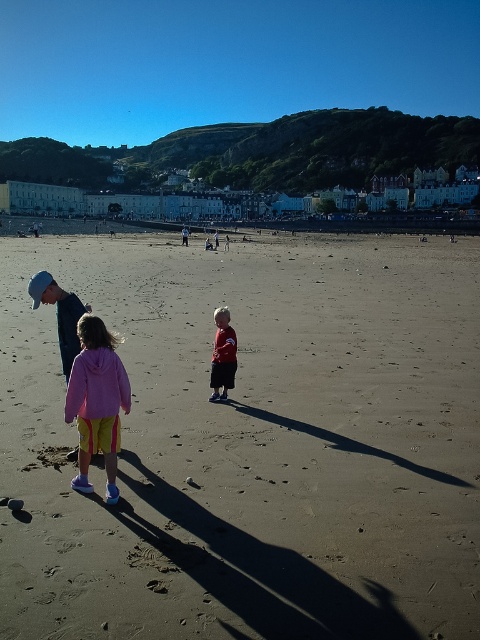
You are a photographer trying to capture a wide shot of the scene. You want to ensure that both the brown sandy beach at center and the matte red shirt at center are clearly visible in the frame. Given their sizes, which object will occupy more space in the photo?

The brown sandy beach at center will occupy more space in the photo because its width is larger than that of the matte red shirt at center.

You are standing on the beach and see two points marked on the sand. The first point is at coordinate point(332, 548) and the second is at point(96, 324). Which point is closer to you if you are facing the ocean?

Point(332, 548) is in front of point(96, 324), so the first point is closer to you.

You are a photographer trying to capture the children in the scene. You want to ensure that the pink fleece jacket at center and the matte red shirt at center are both visible in your shot. Based on their positions, which one should you focus on first to make sure both are in frame?

The pink fleece jacket at center is below the matte red shirt at center, so you should focus on the matte red shirt at center first to ensure both are in frame.